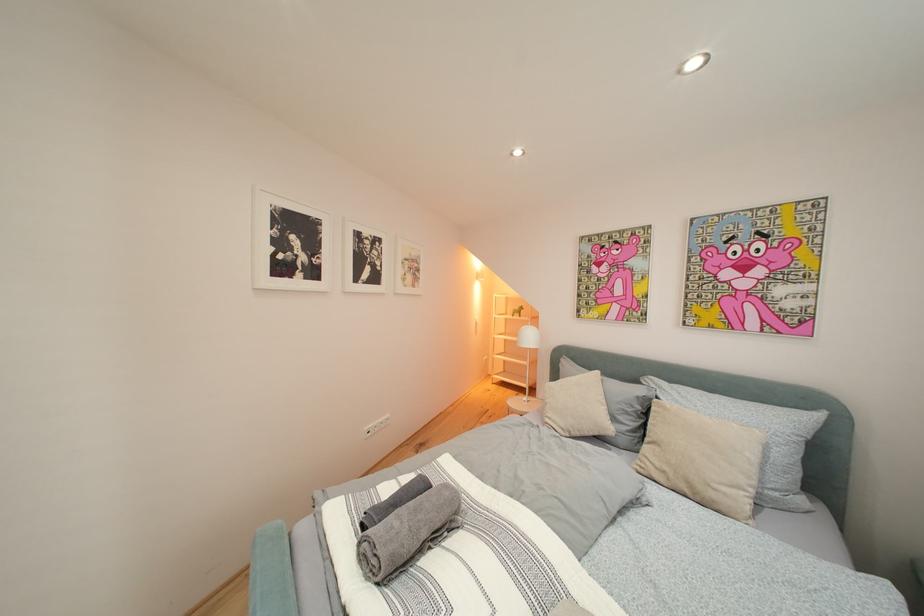
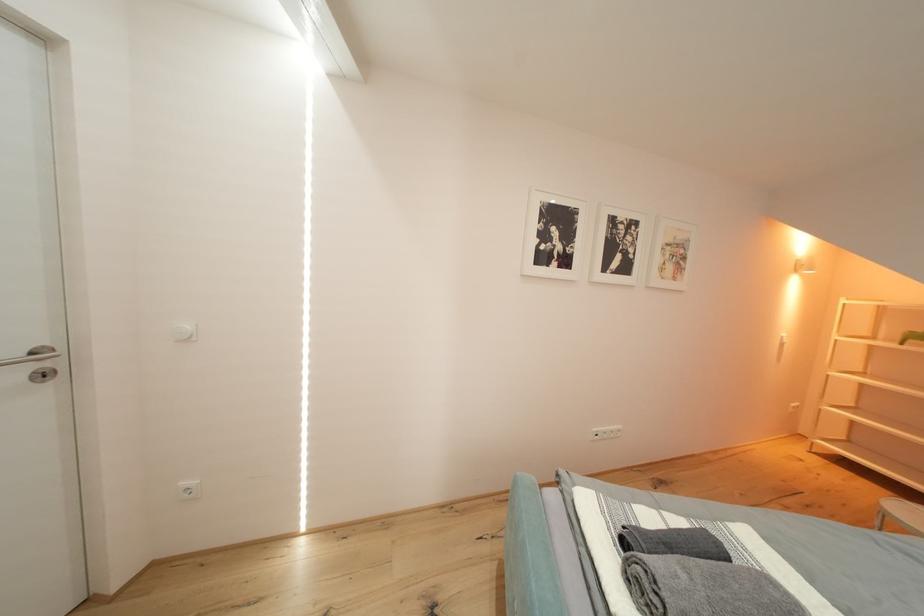
Question: Based on the continuous images, in which direction is the camera rotating? Reply with the corresponding letter.

Choices:
 (A) Left
 (B) Right
 (C) Up
 (D) Down

Answer: (A)